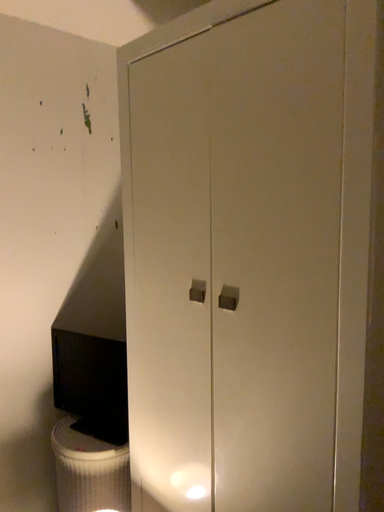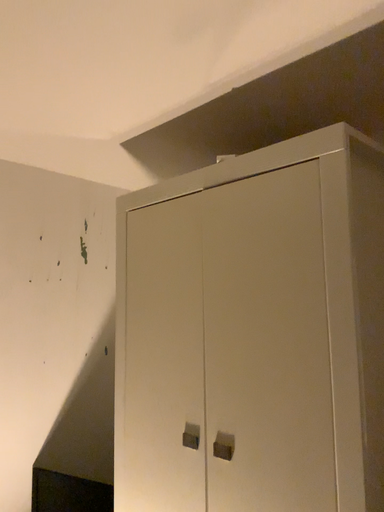
Question: How did the camera likely rotate when shooting the video?

Choices:
 (A) rotated downward
 (B) rotated upward

Answer: (B)